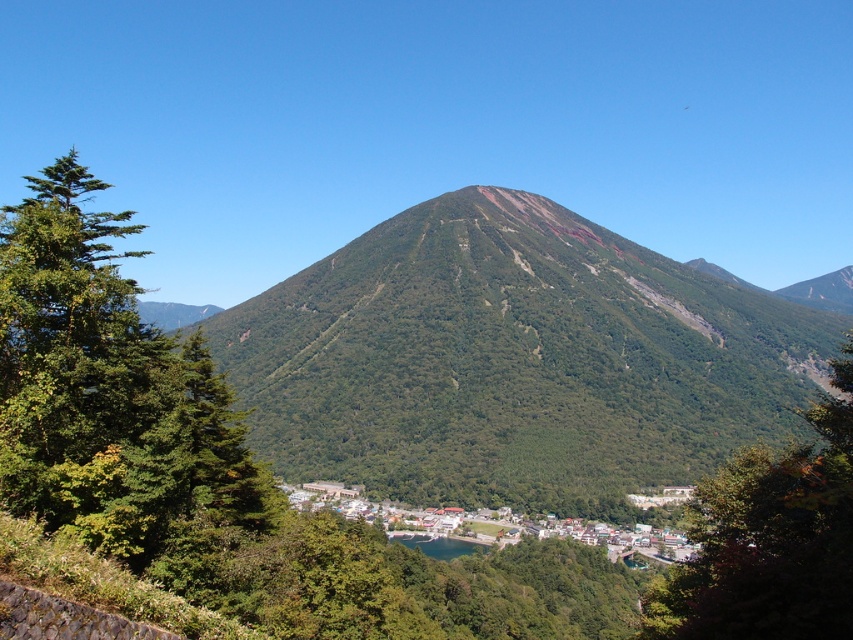
You are planning to build a hiking trail that starts from the green wooden houses at lower center and leads up to the green leafy mountain at center. Considering the spatial relationship between these two objects, which direction should the trail primarily head towards?

The trail should primarily head upwards towards the green leafy mountain at center since it is wider than the green wooden houses at lower center, indicating a larger structure that requires ascending terrain.

You are an observer standing at the base of the mountain. You notice two green leafy trees in the scene. Which tree, the green leafy tree at left or the green leafy tree at center, appears closer to the mountain peak?

The green leafy tree at left is located above the green leafy tree at center, so the green leafy tree at left appears closer to the mountain peak since it is positioned higher in the scene.

You are an environmental scientist assessing the mountain and the tree in the image. Which object is positioned lower in the scene, the green leafy mountain at center or the green leafy tree at left?

The green leafy mountain at center is located below the green leafy tree at left, so the mountain is positioned lower in the scene.